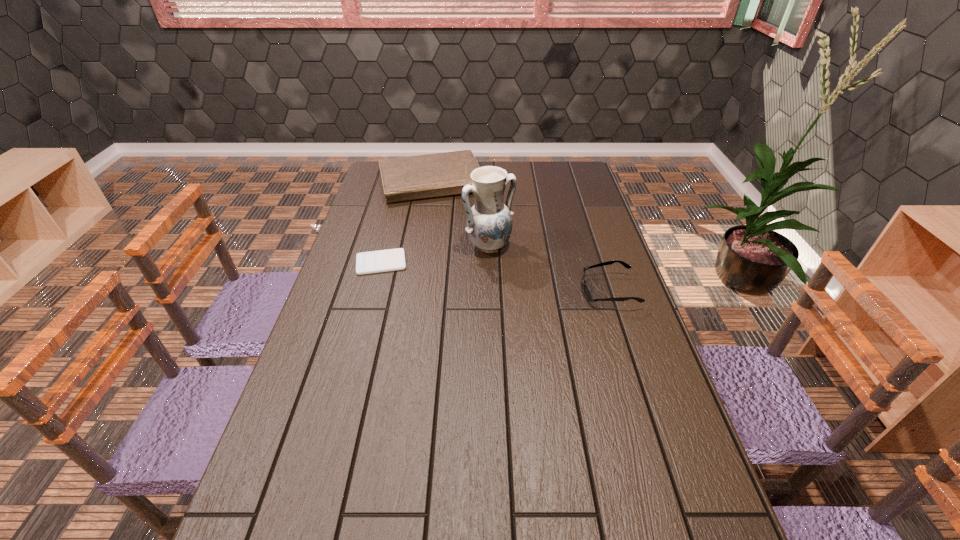
Where is `vacant area that lies between the shortest object and the sunglasses`? Image resolution: width=960 pixels, height=540 pixels. vacant area that lies between the shortest object and the sunglasses is located at coordinates (494, 277).

Locate an element on the screen. vacant space that's between the second tallest object and the tallest object is located at coordinates (462, 214).

Locate an element on the screen. free space between the rightmost object and the second tallest object is located at coordinates (521, 237).

The image size is (960, 540). Identify the location of unoccupied area between the calculator and the tallest object. (435, 254).

The image size is (960, 540). I want to click on vacant point located between the third shortest object and the calculator, so click(408, 222).

Identify which object is the closest to the pottery. Please provide its 2D coordinates. Your answer should be formatted as a tuple, i.e. [(x, y)], where the tuple contains the x and y coordinates of a point satisfying the conditions above.

[(379, 261)]

Select which object appears as the second closest to the pottery. Please provide its 2D coordinates. Your answer should be formatted as a tuple, i.e. [(x, y)], where the tuple contains the x and y coordinates of a point satisfying the conditions above.

[(441, 174)]

The height and width of the screenshot is (540, 960). I want to click on vacant point that satisfies the following two spatial constraints: 1. on the back side of the calculator; 2. on the left side of the tallest object, so [386, 246].

Locate an element on the screen. Image resolution: width=960 pixels, height=540 pixels. free space that satisfies the following two spatial constraints: 1. on the back side of the calculator; 2. on the right side of the tallest object is located at coordinates (386, 246).

Find the location of a particular element. This screenshot has height=540, width=960. free space that satisfies the following two spatial constraints: 1. on the front side of the calculator; 2. on the lenses of the sunglasses is located at coordinates (373, 291).